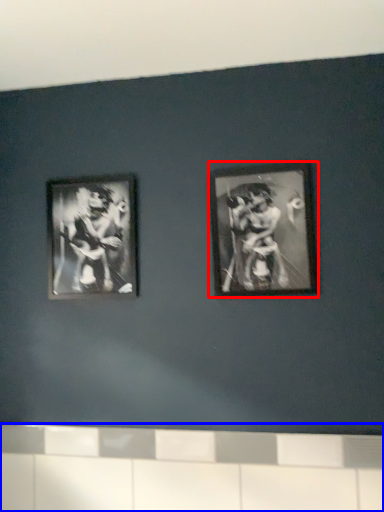
Question: Which of the following is the closest to the observer, picture frame (highlighted by a red box) or ledge (highlighted by a blue box)?

Choices:
 (A) picture frame
 (B) ledge

Answer: (B)